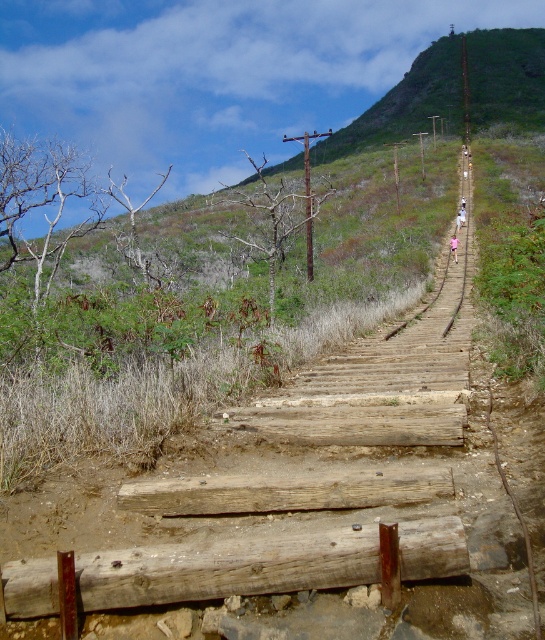
Does weathered wood at center appear on the left side of weathered brown log at center?

Correct, you'll find weathered wood at center to the left of weathered brown log at center.

Which is behind, point (28, 582) or point (173, 515)?

Positioned behind is point (173, 515).

Where is `weathered wood at center`? The image size is (545, 640). weathered wood at center is located at coordinates (228, 566).